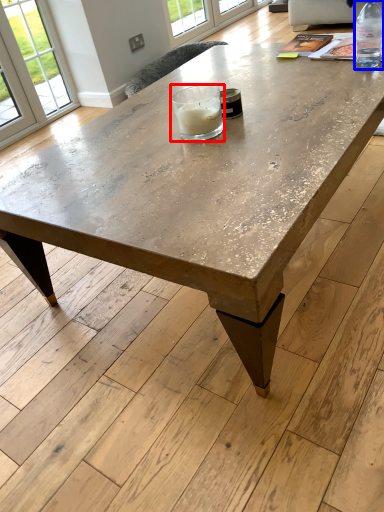
Question: Among these objects, which one is farthest to the camera, candle holder (highlighted by a red box) or bottle (highlighted by a blue box)?

Choices:
 (A) candle holder
 (B) bottle

Answer: (B)